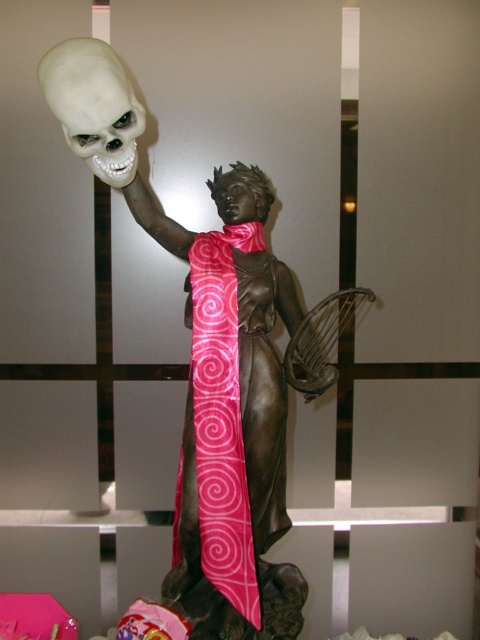
You are a photographer standing 1.62 meters away from the camera. You want to take a closeup shot of the pink silk tie at center. Can you adjust your position to get a closer shot without moving the camera?

The pink silk tie at center and camera are 1.62 meters apart from each other. Since you are already standing 1.62 meters away from the camera, you cannot move any closer to the camera to get a closer shot without moving the camera itself.

You are an art curator planning to move the bronze statue at center and the pink silk tie at center to a new exhibition space. The new space has a strict rule that all displayed items must be arranged from left to right in order of their size, starting with the smallest. Based on the current arrangement in the original image, can you determine which item should be placed first in the new arrangement?

The bronze statue at center is positioned on the right side of the pink silk tie at center, which implies that the pink silk tie at center is smaller than the bronze statue at center. Therefore, the pink silk tie at center should be placed first in the new arrangement.

You are an art curator planning to display the bronze statue at center and the white matte skull at upper left in a new exhibition. Given their sizes, which object would require a larger display base to accommodate its width?

The bronze statue at center requires a larger display base because its width surpasses that of the white matte skull at upper left.